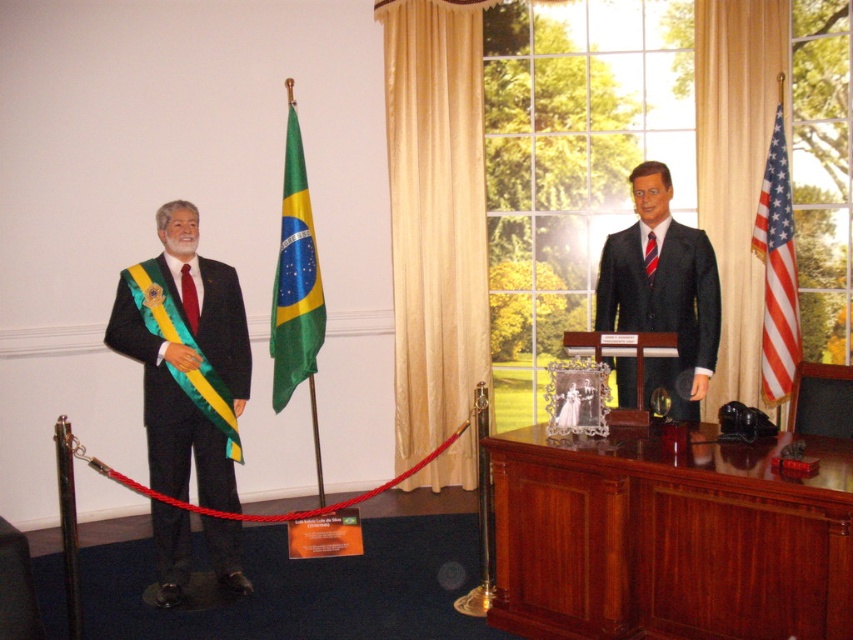
Can you confirm if american flag at right is positioned below red satin tie at left?

Actually, american flag at right is above red satin tie at left.

Find the location of a particular element. The width and height of the screenshot is (853, 640). american flag at right is located at coordinates (776, 272).

Between point (782, 369) and point (190, 278), which one is positioned in front?

Positioned in front is point (190, 278).

Find the location of `american flag at right`. american flag at right is located at coordinates (776, 272).

Between point (119, 292) and point (642, 212), which one is positioned behind?

The point (642, 212) is more distant.

Between matte black suit at left and shiny dark suit at center, which one has more height?

Standing taller between the two is matte black suit at left.

Is point (199, 358) farther from camera compared to point (688, 269)?

No, (199, 358) is in front of (688, 269).

Find the location of a particular element. Image resolution: width=853 pixels, height=640 pixels. matte black suit at left is located at coordinates (187, 364).

Between point (173, 253) and point (300, 205), which one is positioned behind?

Point (300, 205)

Who is shorter, matte black suit at left or green satin flag at center?

green satin flag at center

Which is in front, point (207, 324) or point (312, 291)?

Point (207, 324)

Find the location of `matte black suit at left`. matte black suit at left is located at coordinates (187, 364).